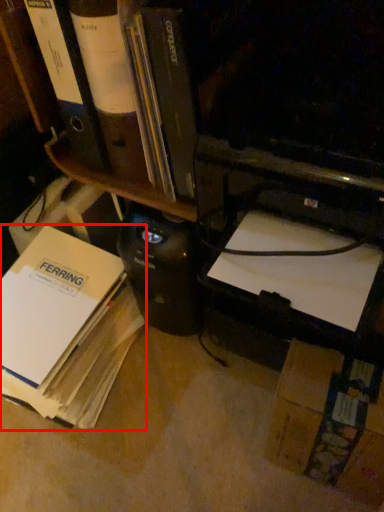
Question: From the image's perspective, considering the relative positions of book (annotated by the red box) and bookshelf in the image provided, where is book (annotated by the red box) located with respect to the staircase?

Choices:
 (A) below
 (B) above

Answer: (A)